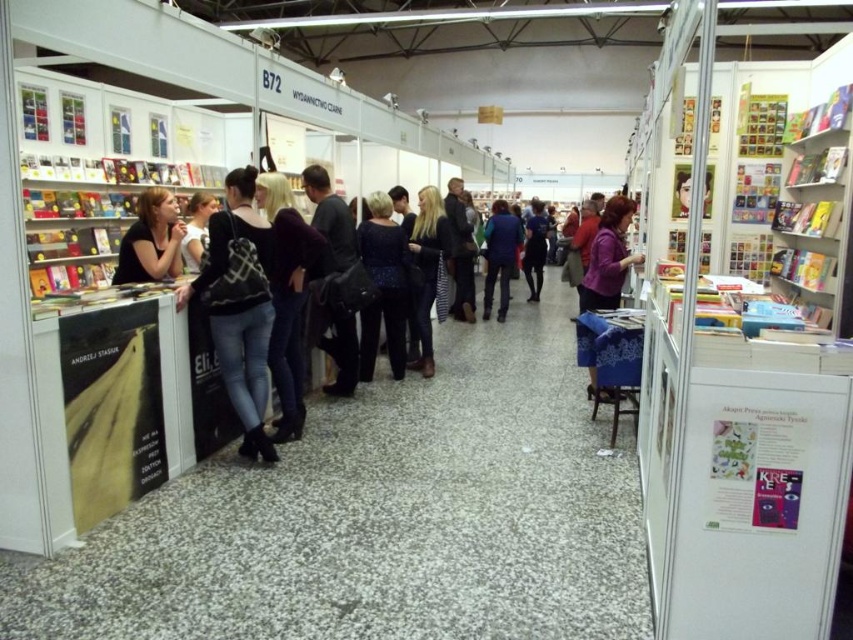
Consider the image. Does purple fabric skirt at center have a larger size compared to dark blue jeans at center?

Incorrect, purple fabric skirt at center is not larger than dark blue jeans at center.

Locate an element on the screen. purple fabric skirt at center is located at coordinates (608, 257).

Where is `purple fabric skirt at center`? The height and width of the screenshot is (640, 853). purple fabric skirt at center is located at coordinates (608, 257).

Does dark gray fabric jacket at center have a lesser height compared to dark blue jeans at center?

Yes, dark gray fabric jacket at center is shorter than dark blue jeans at center.

Which is behind, point (306, 170) or point (532, 282)?

The point (532, 282) is more distant.

This screenshot has width=853, height=640. What do you see at coordinates (329, 221) in the screenshot?
I see `dark gray fabric jacket at center` at bounding box center [329, 221].

Locate an element on the screen. The width and height of the screenshot is (853, 640). dark gray fabric jacket at center is located at coordinates [x=329, y=221].

Is dark purple sweater at center to the right of purple fabric skirt at center from the viewer's perspective?

In fact, dark purple sweater at center is to the left of purple fabric skirt at center.

Which is in front, point (289, 317) or point (614, 202)?

Point (289, 317) is more forward.

Which is behind, point (283, 349) or point (624, 202)?

The point (624, 202) is behind.

The height and width of the screenshot is (640, 853). What are the coordinates of `dark purple sweater at center` in the screenshot? It's located at (287, 296).